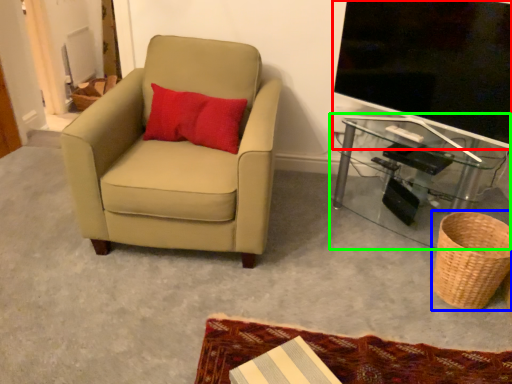
Question: Which object is positioned closest to television (highlighted by a red box)? Select from basket (highlighted by a blue box) and table (highlighted by a green box).

Choices:
 (A) basket
 (B) table

Answer: (B)